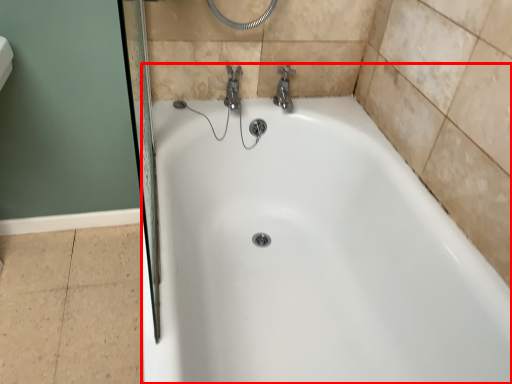
Question: In this image, where is bathtub (annotated by the red box) located relative to tap?

Choices:
 (A) left
 (B) right

Answer: (A)